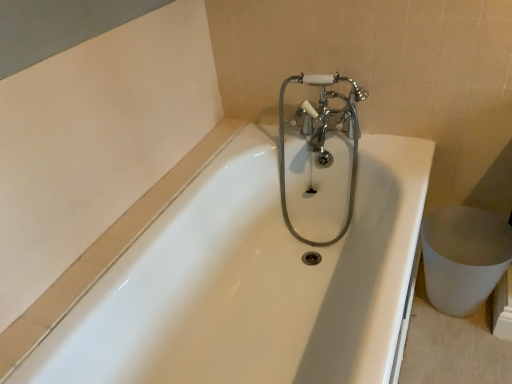
Locate an element on the screen. Image resolution: width=512 pixels, height=384 pixels. white glossy bathtub at center is located at coordinates (257, 274).

This screenshot has height=384, width=512. What do you see at coordinates (257, 274) in the screenshot? I see `white glossy bathtub at center` at bounding box center [257, 274].

Describe the element at coordinates (322, 136) in the screenshot. I see `chrome/polished metal faucet at center` at that location.

Where is `chrome/polished metal faucet at center`? This screenshot has width=512, height=384. chrome/polished metal faucet at center is located at coordinates (322, 136).

The width and height of the screenshot is (512, 384). Find the location of `white glossy bathtub at center`. white glossy bathtub at center is located at coordinates (257, 274).

Based on the photo, which object is positioned more to the right, white glossy bathtub at center or chrome/polished metal faucet at center?

From the viewer's perspective, chrome/polished metal faucet at center appears more on the right side.

Is white glossy bathtub at center closer to camera compared to chrome/polished metal faucet at center?

Yes, it is.

Is point (228, 216) closer or farther from the camera than point (338, 236)?

Point (228, 216).

From the image's perspective, is white glossy bathtub at center above or below chrome/polished metal faucet at center?

From the image's perspective, white glossy bathtub at center appears below chrome/polished metal faucet at center.

From a real-world perspective, is white glossy bathtub at center positioned under chrome/polished metal faucet at center based on gravity?

Indeed, from a real-world perspective, white glossy bathtub at center is positioned beneath chrome/polished metal faucet at center.

Considering the sizes of white glossy bathtub at center and chrome/polished metal faucet at center in the image, is white glossy bathtub at center wider or thinner than chrome/polished metal faucet at center?

In the image, white glossy bathtub at center appears to be wider than chrome/polished metal faucet at center.

Considering the sizes of objects white glossy bathtub at center and chrome/polished metal faucet at center in the image provided, who is shorter, white glossy bathtub at center or chrome/polished metal faucet at center?

With less height is white glossy bathtub at center.

Which of these two, white glossy bathtub at center or chrome/polished metal faucet at center, is smaller?

With smaller size is chrome/polished metal faucet at center.

Is chrome/polished metal faucet at center completely or partially inside white glossy bathtub at center?

Absolutely, chrome/polished metal faucet at center is inside white glossy bathtub at center.

Is white glossy bathtub at center far away from chrome/polished metal faucet at center?

No, there isn't a large distance between white glossy bathtub at center and chrome/polished metal faucet at center.

Is white glossy bathtub at center facing away from chrome/polished metal faucet at center?

No, chrome/polished metal faucet at center is not at the back of white glossy bathtub at center.

How different are the orientations of white glossy bathtub at center and chrome/polished metal faucet at center in degrees?

The angle between the facing direction of white glossy bathtub at center and the facing direction of chrome/polished metal faucet at center is 89.5 degrees.

Where is `bathtub to the left of chrome/polished metal faucet at center`? bathtub to the left of chrome/polished metal faucet at center is located at coordinates (257, 274).

Would you say chrome/polished metal faucet at center is to the left or to the right of white glossy bathtub at center in the picture?

chrome/polished metal faucet at center is to the right of white glossy bathtub at center.

Which object is further away from the camera taking this photo, chrome/polished metal faucet at center or white glossy bathtub at center?

chrome/polished metal faucet at center is behind.

Which is closer, (347, 117) or (234, 246)?

Clearly, point (347, 117) is closer to the camera than point (234, 246).

From the image's perspective, is chrome/polished metal faucet at center above or below white glossy bathtub at center?

Based on their image positions, chrome/polished metal faucet at center is located above white glossy bathtub at center.

In the scene shown: From a real-world perspective, is chrome/polished metal faucet at center located higher than white glossy bathtub at center?

Yes, from a real-world perspective, chrome/polished metal faucet at center is on top of white glossy bathtub at center.

Considering the sizes of objects chrome/polished metal faucet at center and white glossy bathtub at center in the image provided, who is wider, chrome/polished metal faucet at center or white glossy bathtub at center?

Wider between the two is white glossy bathtub at center.

Who is shorter, chrome/polished metal faucet at center or white glossy bathtub at center?

white glossy bathtub at center is shorter.

Between chrome/polished metal faucet at center and white glossy bathtub at center, which one has larger size?

white glossy bathtub at center.

Can we say chrome/polished metal faucet at center lies outside white glossy bathtub at center?

No, chrome/polished metal faucet at center is inside white glossy bathtub at center's boundary.

Is the surface of chrome/polished metal faucet at center in direct contact with white glossy bathtub at center?

chrome/polished metal faucet at center is not next to white glossy bathtub at center, and they're not touching.

Looking at this image, is chrome/polished metal faucet at center positioned with its back to white glossy bathtub at center?

Yes, white glossy bathtub at center is at the back of chrome/polished metal faucet at center.

Measure the distance between chrome/polished metal faucet at center and white glossy bathtub at center.

They are 11.03 inches apart.

You are a GUI agent. You are given a task and a screenshot of the screen. Output one action in this format:
    pyautogui.click(x=<x>, y=<y>)
    Task: Click on the bathtub in front of the chrome/polished metal faucet at center
    The image size is (512, 384).
    Given the screenshot: What is the action you would take?
    pyautogui.click(x=257, y=274)

Locate an element on the screen. The image size is (512, 384). bathtub beneath the chrome/polished metal faucet at center (from a real-world perspective) is located at coordinates (257, 274).

The height and width of the screenshot is (384, 512). What are the coordinates of `tap to the right of white glossy bathtub at center` in the screenshot? It's located at (322, 136).